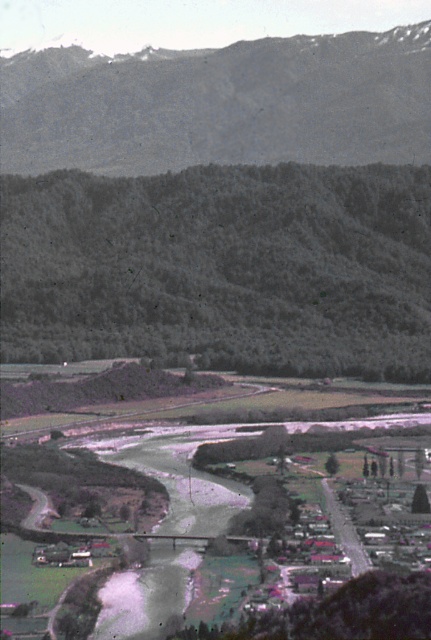
Question: Is dark green forested hillside at center below rugged stone mountain at upper center?

Choices:
 (A) no
 (B) yes

Answer: (B)

Question: Can you confirm if dark green forested hillside at center is thinner than rugged stone mountain at upper center?

Choices:
 (A) no
 (B) yes

Answer: (B)

Question: Among these objects, which one is farthest from the camera?

Choices:
 (A) rugged stone mountain at upper center
 (B) dark green forested hillside at center

Answer: (A)

Question: Which object is farther from the camera taking this photo?

Choices:
 (A) dark green forested hillside at center
 (B) rugged stone mountain at upper center

Answer: (B)

Question: Can you confirm if dark green forested hillside at center is wider than rugged stone mountain at upper center?

Choices:
 (A) yes
 (B) no

Answer: (B)